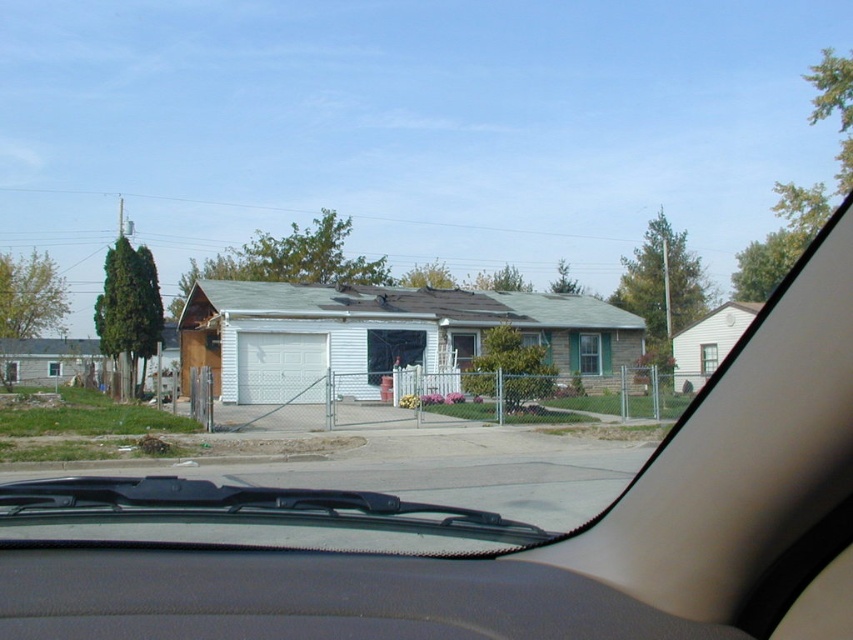
Question: Which object is closer to the camera taking this photo?

Choices:
 (A) gray fabric dashboard at lower center
 (B) matte white car at center
 (C) white painted wood garage at center

Answer: (A)

Question: Does matte white car at center have a lesser width compared to white painted wood garage at center?

Choices:
 (A) yes
 (B) no

Answer: (A)

Question: Can you confirm if matte white car at center is positioned to the right of white painted wood garage at center?

Choices:
 (A) yes
 (B) no

Answer: (B)

Question: Where is gray fabric dashboard at lower center located in relation to white painted wood garage at center in the image?

Choices:
 (A) below
 (B) above

Answer: (A)

Question: Which object is farther from the camera taking this photo?

Choices:
 (A) gray fabric dashboard at lower center
 (B) white painted wood garage at center

Answer: (B)

Question: Which of the following is the farthest from the observer?

Choices:
 (A) gray fabric dashboard at lower center
 (B) white painted wood garage at center

Answer: (B)